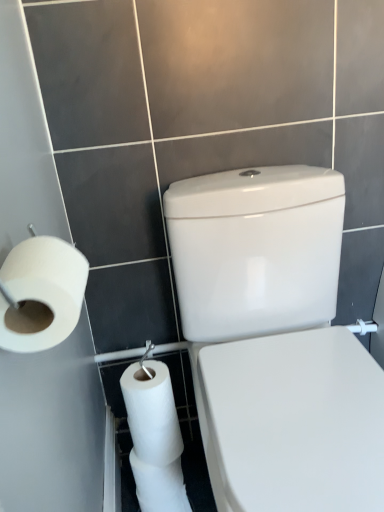
Question: Does white glossy porcelain at center have a lesser height compared to white matte toilet paper at left?

Choices:
 (A) yes
 (B) no

Answer: (B)

Question: Does white glossy porcelain at center turn towards white matte toilet paper at left?

Choices:
 (A) no
 (B) yes

Answer: (A)

Question: Is white glossy porcelain at center positioned behind white matte toilet paper at left?

Choices:
 (A) no
 (B) yes

Answer: (A)

Question: Does white glossy porcelain at center have a smaller size compared to white matte toilet paper at left?

Choices:
 (A) yes
 (B) no

Answer: (B)

Question: Considering the relative sizes of white glossy porcelain at center and white matte toilet paper at left in the image provided, is white glossy porcelain at center thinner than white matte toilet paper at left?

Choices:
 (A) yes
 (B) no

Answer: (B)

Question: Is white glossy porcelain at center bigger than white matte toilet paper at left?

Choices:
 (A) yes
 (B) no

Answer: (A)

Question: Considering the relative sizes of white matte toilet paper at left and white glossy porcelain at center in the image provided, is white matte toilet paper at left wider than white glossy porcelain at center?

Choices:
 (A) no
 (B) yes

Answer: (A)

Question: From the image's perspective, does white matte toilet paper at left appear lower than white glossy porcelain at center?

Choices:
 (A) yes
 (B) no

Answer: (B)

Question: Is the depth of white matte toilet paper at left greater than that of white glossy porcelain at center?

Choices:
 (A) no
 (B) yes

Answer: (B)

Question: Does white matte toilet paper at left appear on the left side of white glossy porcelain at center?

Choices:
 (A) no
 (B) yes

Answer: (B)

Question: From the image's perspective, does white matte toilet paper at left appear higher than white glossy porcelain at center?

Choices:
 (A) yes
 (B) no

Answer: (A)

Question: From a real-world perspective, is white matte toilet paper at left over white glossy porcelain at center?

Choices:
 (A) no
 (B) yes

Answer: (B)

Question: From the image's perspective, is white matte toilet paper at left above or below white glossy porcelain at center?

Choices:
 (A) above
 (B) below

Answer: (A)